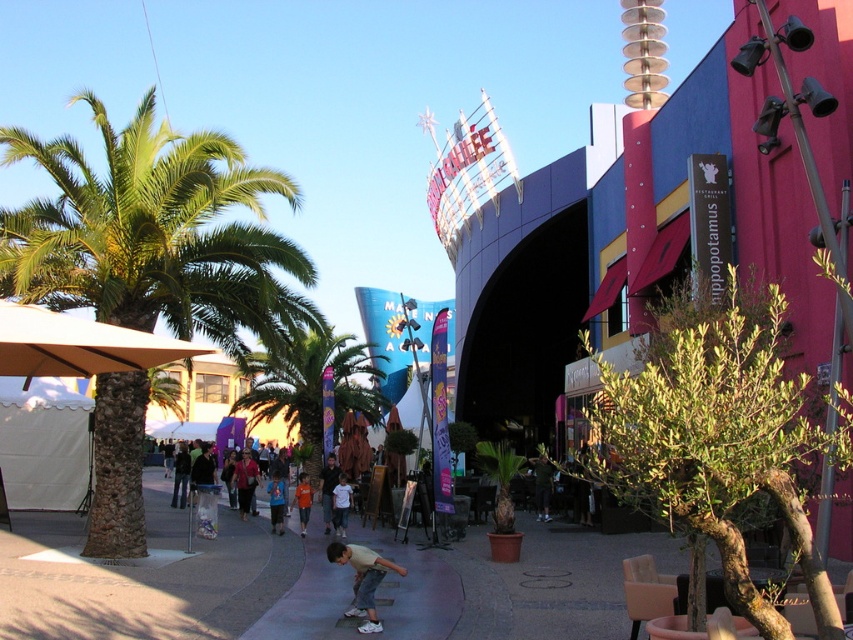
In the scene shown: Is light brown shirt at lower center above orange cotton shirt at lower center?

Yes.

Can you confirm if light brown shirt at lower center is shorter than orange cotton shirt at lower center?

Yes, light brown shirt at lower center is shorter than orange cotton shirt at lower center.

Is point (329, 461) more distant than point (300, 522)?

Yes.

This screenshot has width=853, height=640. I want to click on light brown shirt at lower center, so click(x=328, y=490).

In the scene shown: Is light brown wooden skateboard at lower center bigger than denim shorts at lower center?

Yes, light brown wooden skateboard at lower center is bigger than denim shorts at lower center.

Which is more to the right, light brown wooden skateboard at lower center or denim shorts at lower center?

light brown wooden skateboard at lower center

Between point (376, 580) and point (256, 470), which one is positioned behind?

Positioned behind is point (256, 470).

Identify the location of light brown wooden skateboard at lower center. (363, 579).

Can you confirm if denim shorts at lower center is thinner than light brown shirt at lower center?

Yes, denim shorts at lower center is thinner than light brown shirt at lower center.

Does denim shorts at lower center have a lesser height compared to light brown shirt at lower center?

Correct, denim shorts at lower center is not as tall as light brown shirt at lower center.

Which is behind, point (247, 484) or point (323, 465)?

Point (323, 465)

You are a GUI agent. You are given a task and a screenshot of the screen. Output one action in this format:
    pyautogui.click(x=<x>, y=<y>)
    Task: Click on the denim shorts at lower center
    
    Given the screenshot: What is the action you would take?
    pyautogui.click(x=245, y=481)